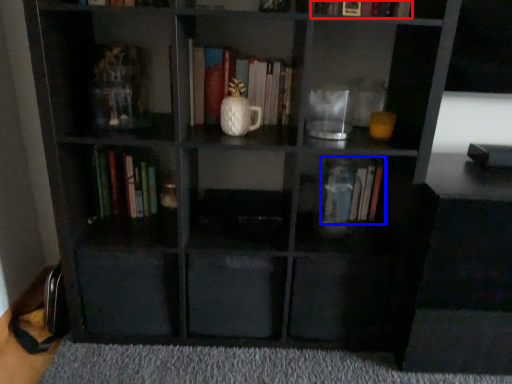
Question: Which object is closer to the camera taking this photo, book (highlighted by a red box) or book (highlighted by a blue box)?

Choices:
 (A) book
 (B) book

Answer: (A)